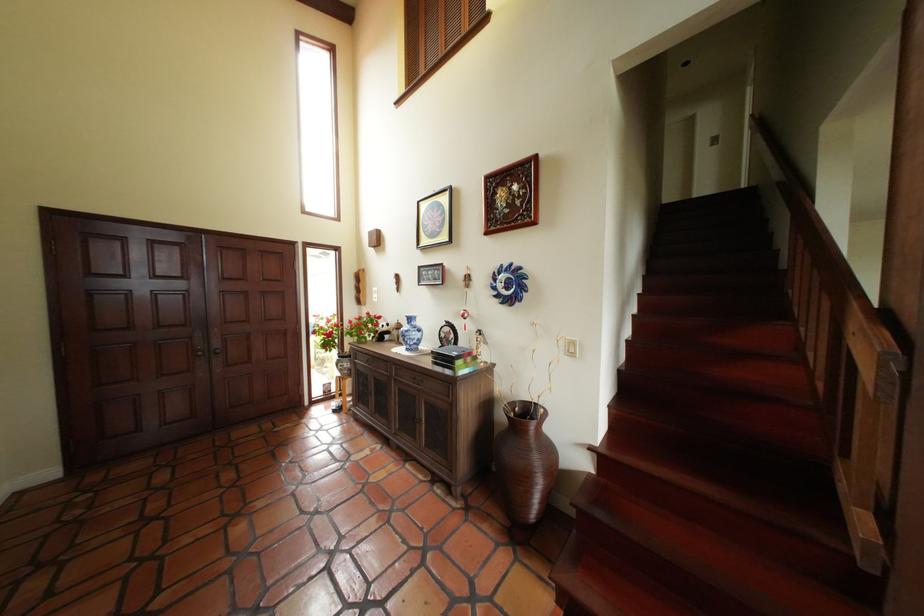
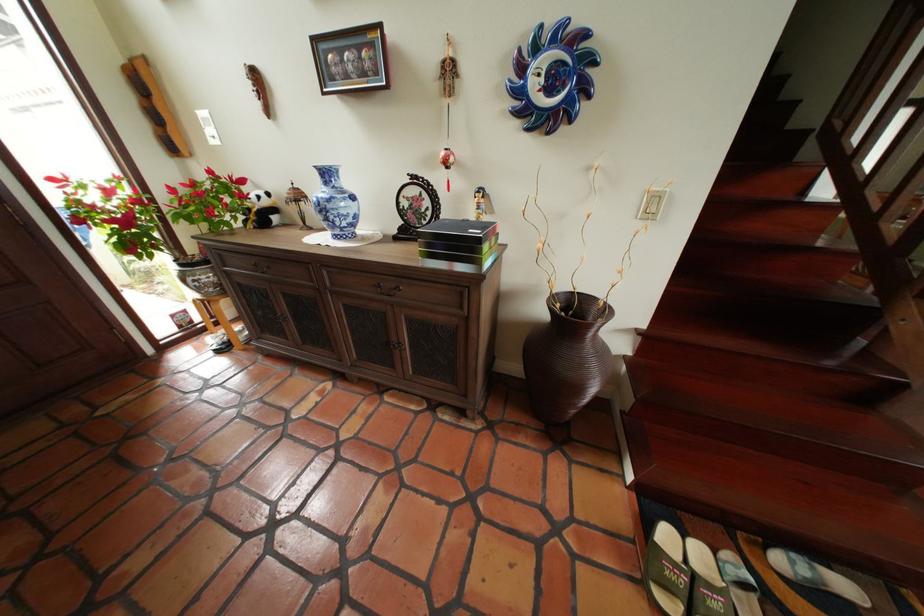
Find the pixel in the second image that matches point (546, 405) in the first image.

(590, 294)